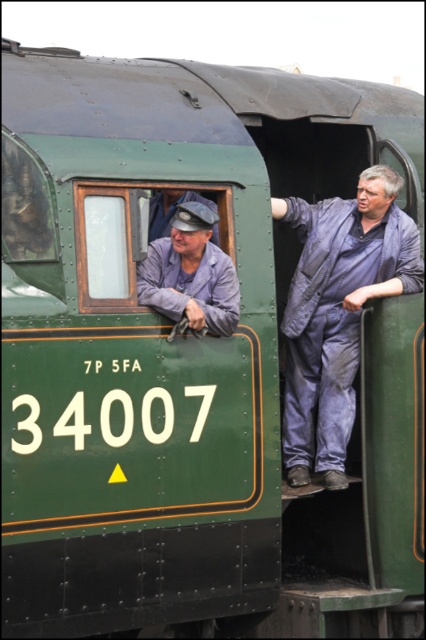
You are a photographer standing in front of the vintage steam locomotive. You want to capture a photo of both the blue denim jumpsuit at right and the matte blue uniform at center. Which person should you position to your right to include both in the frame?

The blue denim jumpsuit at right is positioned on the right side of the matte blue uniform at center. Therefore, to include both in the frame, you should position the blue denim jumpsuit at right to your right side.

You are a train inspector standing near the vintage steam locomotive. You notice two items in the scene that are important for your inspection report. The items are the matte blue uniform at center and the denim cap at left. According to the spatial arrangement, which item is positioned to the right of the other?

The matte blue uniform at center is positioned to the right of the denim cap at left.

You are standing in front of the vintage steam locomotive and notice two points marked on its side. Which of the two points, point (149,266) or point (175,200), is closer to you?

Point (149,266) is closer to the viewer than point (175,200).